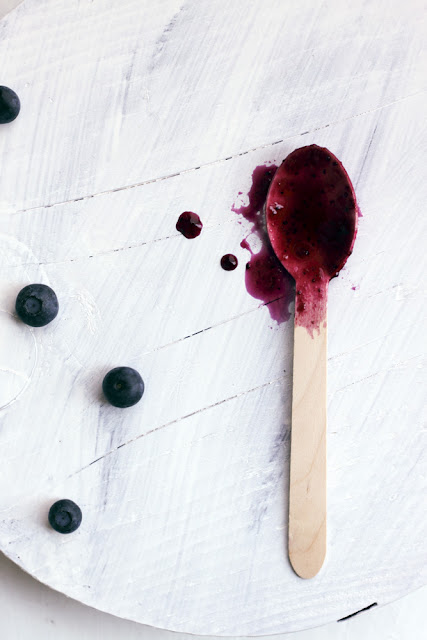
The width and height of the screenshot is (427, 640). Find the location of `table`. table is located at coordinates (38, 612).